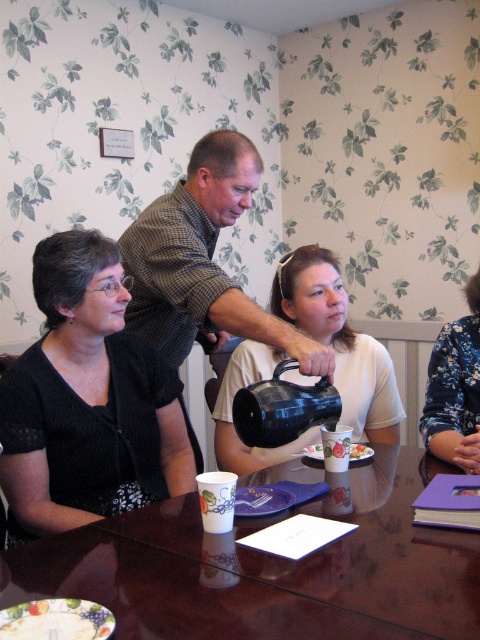
Question: Which is nearer to the glossy plastic table at center?

Choices:
 (A) blue floral blouse at upper right
 (B) matte black pitcher at center
 (C) white paper plate at lower center
 (D) black matte teapot at center

Answer: (D)

Question: Which object appears farthest from the camera in this image?

Choices:
 (A) matte black teapot at center
 (B) glossy plastic table at center

Answer: (A)

Question: Is matte black sweater at left positioned at the back of black matte teapot at center?

Choices:
 (A) yes
 (B) no

Answer: (A)

Question: Considering the relative positions of matte black sweater at left and white paper plate at lower center in the image provided, where is matte black sweater at left located with respect to white paper plate at lower center?

Choices:
 (A) left
 (B) right

Answer: (A)

Question: Which is nearer to the blue floral blouse at upper right?

Choices:
 (A) matte black teapot at center
 (B) white paper plate at lower center
 (C) black matte teapot at center

Answer: (B)

Question: Is matte black teapot at center to the left of black matte teapot at center from the viewer's perspective?

Choices:
 (A) no
 (B) yes

Answer: (A)